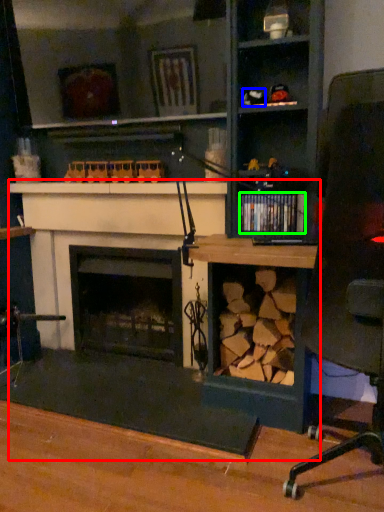
Question: Which object is positioned closest to computer desk (highlighted by a red box)? Select from toy (highlighted by a blue box) and book (highlighted by a green box).

Choices:
 (A) toy
 (B) book

Answer: (B)